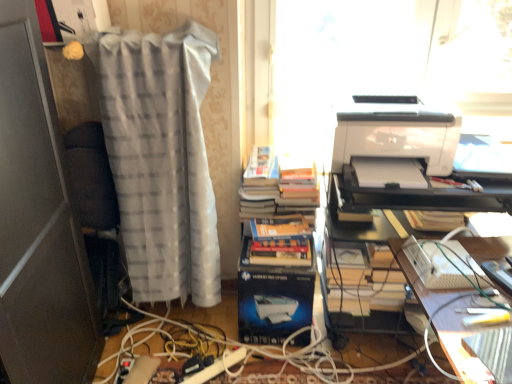
You are a GUI agent. You are given a task and a screenshot of the screen. Output one action in this format:
    pyautogui.click(x=<x>, y=<y>)
    Task: Click on the vacant area that is in front of white plastic keyboard at lower right, which ranks as the 2th equipment in right-to-left order
    This screenshot has height=384, width=512.
    Given the screenshot: What is the action you would take?
    pyautogui.click(x=464, y=304)